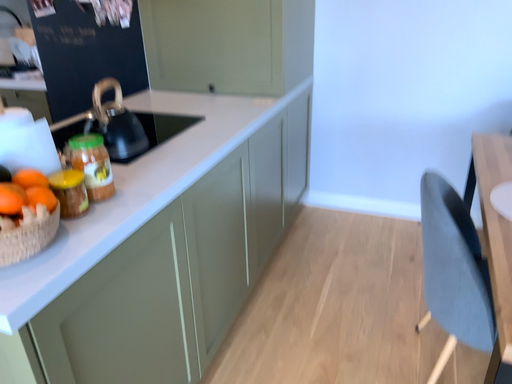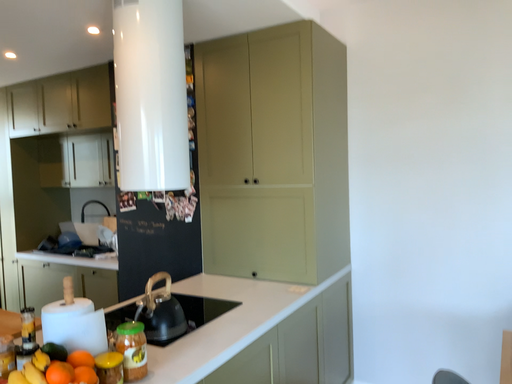
Question: How did the camera likely rotate when shooting the video?

Choices:
 (A) rotated right
 (B) rotated left

Answer: (B)